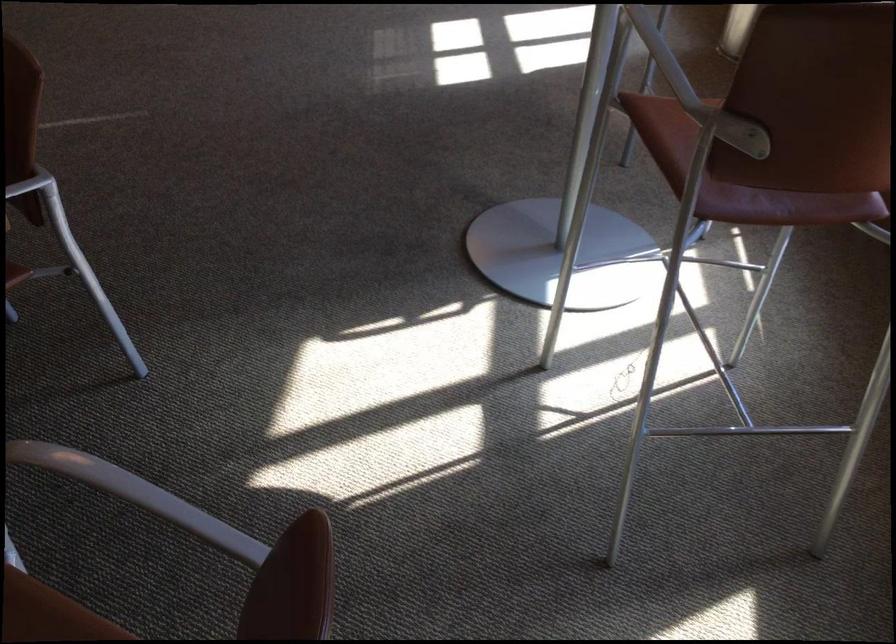
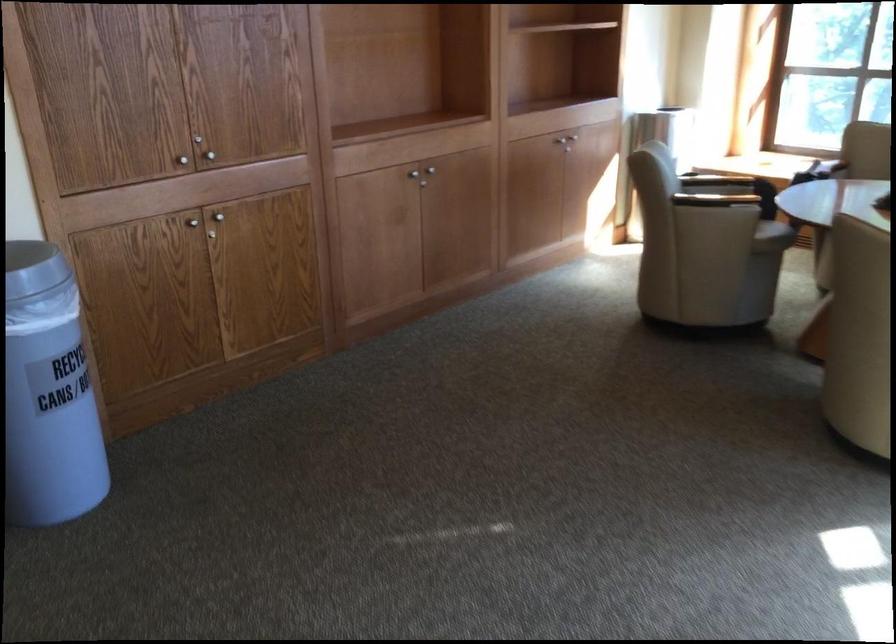
In a continuous first-person perspective shot, in which direction is the camera moving?

The movement direction of the cameraman is left, forward.